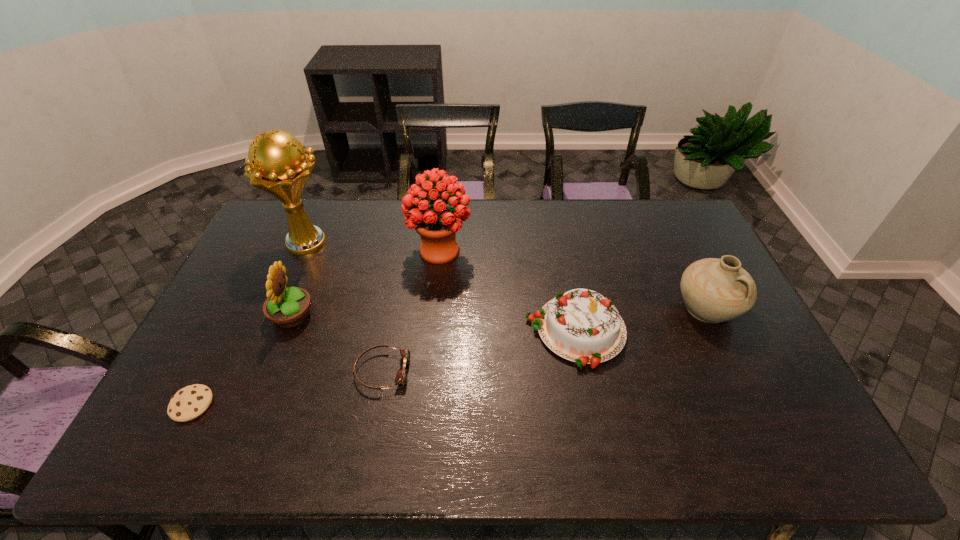
Image resolution: width=960 pixels, height=540 pixels. Find the location of `object that is at the far left corner`. object that is at the far left corner is located at coordinates (276, 163).

The height and width of the screenshot is (540, 960). Identify the location of vacant area at the far edge. (542, 213).

Image resolution: width=960 pixels, height=540 pixels. I want to click on vacant space at the near edge, so click(543, 433).

You are a GUI agent. You are given a task and a screenshot of the screen. Output one action in this format:
    pyautogui.click(x=<x>, y=<y>)
    Task: Click on the free location at the left edge of the desktop
    This screenshot has height=540, width=960.
    Given the screenshot: What is the action you would take?
    pyautogui.click(x=292, y=260)

In the image, there is a desktop. Where is `vacant region at the right edge`? vacant region at the right edge is located at coordinates (742, 369).

Find the location of a particular element. The width and height of the screenshot is (960, 540). vacant space at the far right corner is located at coordinates (679, 212).

Image resolution: width=960 pixels, height=540 pixels. I want to click on unoccupied position between the tallest object and the sunflower, so click(x=300, y=279).

Find the location of `vacant space that's between the third shortest object and the sixth tallest object`. vacant space that's between the third shortest object and the sixth tallest object is located at coordinates (479, 352).

Where is `blank region between the fifth tallest object and the second tallest object`? blank region between the fifth tallest object and the second tallest object is located at coordinates (508, 291).

You are a GUI agent. You are given a task and a screenshot of the screen. Output one action in this format:
    pyautogui.click(x=<x>, y=<y>)
    Task: Click on the free space that is in between the third shortest object and the cookie
    
    Given the screenshot: What is the action you would take?
    pyautogui.click(x=384, y=368)